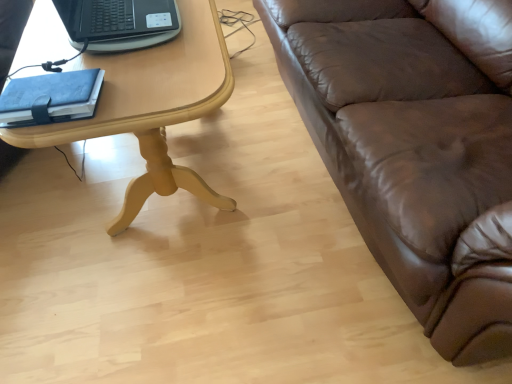
At what (x,y) coordinates should I click in order to perform the action: click on brown leather couch at right. Please return your answer as a coordinate pair (x, y). Image resolution: width=512 pixels, height=384 pixels. Looking at the image, I should click on (416, 147).

This screenshot has height=384, width=512. I want to click on blue leather notebook at left, so click(50, 98).

Is the surface of black plastic laptop at upper left in direct contact with brown leather couch at right?

There is a gap between black plastic laptop at upper left and brown leather couch at right.

Does point (176, 9) appear closer or farther from the camera than point (436, 27)?

Point (176, 9).

From a real-world perspective, who is located lower, black plastic laptop at upper left or brown leather couch at right?

In real-world perspective, brown leather couch at right is lower.

Identify the location of studio couch above the black plastic laptop at upper left (from the image's perspective). The image size is (512, 384). (416, 147).

Is brown leather couch at right facing away from blue leather notebook at left?

That's not correct — brown leather couch at right is not looking away from blue leather notebook at left.

From a real-world perspective, is brown leather couch at right physically below blue leather notebook at left?

Yes, from a real-world perspective, brown leather couch at right is beneath blue leather notebook at left.

From the image's perspective, would you say brown leather couch at right is shown under blue leather notebook at left?

Incorrect, from the image's perspective, brown leather couch at right is higher than blue leather notebook at left.

Considering the sizes of objects brown leather couch at right and blue leather notebook at left in the image provided, who is smaller, brown leather couch at right or blue leather notebook at left?

blue leather notebook at left.

Is black plastic laptop at upper left surrounding blue leather notebook at left?

That's incorrect, blue leather notebook at left is not inside black plastic laptop at upper left.

Considering the relative sizes of black plastic laptop at upper left and blue leather notebook at left in the image provided, is black plastic laptop at upper left thinner than blue leather notebook at left?

In fact, black plastic laptop at upper left might be wider than blue leather notebook at left.

In the scene shown: From the image's perspective, is black plastic laptop at upper left below blue leather notebook at left?

No.

In the scene shown: Is black plastic laptop at upper left oriented towards blue leather notebook at left?

No, black plastic laptop at upper left is not oriented towards blue leather notebook at left.

Is blue leather notebook at left positioned in front of black plastic laptop at upper left?

Yes, it is in front of black plastic laptop at upper left.

Considering the positions of points (95, 95) and (66, 20), is point (95, 95) farther from camera compared to point (66, 20)?

No, (95, 95) is in front of (66, 20).

Looking at this image, from the image's perspective, which one is positioned lower, blue leather notebook at left or black plastic laptop at upper left?

blue leather notebook at left appears lower in the image.

Between blue leather notebook at left and black plastic laptop at upper left, which one has more height?

black plastic laptop at upper left.

From a real-world perspective, is light wood/yellowishmaterial/texture table at left positioned over black plastic laptop at upper left based on gravity?

Incorrect, from a real-world perspective, light wood/yellowishmaterial/texture table at left is lower than black plastic laptop at upper left.

Based on their sizes in the image, would you say light wood/yellowishmaterial/texture table at left is bigger or smaller than black plastic laptop at upper left?

Clearly, light wood/yellowishmaterial/texture table at left is larger in size than black plastic laptop at upper left.

How many degrees apart are the facing directions of light wood/yellowishmaterial/texture table at left and black plastic laptop at upper left?

The angle between the facing direction of light wood/yellowishmaterial/texture table at left and the facing direction of black plastic laptop at upper left is 0.693 degrees.

Where is `table located in front of the black plastic laptop at upper left`? The image size is (512, 384). table located in front of the black plastic laptop at upper left is located at coordinates (153, 106).

From a real-world perspective, between black plastic laptop at upper left and light wood/yellowishmaterial/texture table at left, who is vertically higher?

black plastic laptop at upper left.

From the image's perspective, which is below, black plastic laptop at upper left or light wood/yellowishmaterial/texture table at left?

From the image's view, light wood/yellowishmaterial/texture table at left is below.

Does black plastic laptop at upper left come in front of light wood/yellowishmaterial/texture table at left?

No, the depth of black plastic laptop at upper left is greater than that of light wood/yellowishmaterial/texture table at left.

Can you tell me how much black plastic laptop at upper left and light wood/yellowishmaterial/texture table at left differ in facing direction?

The angle between the facing direction of black plastic laptop at upper left and the facing direction of light wood/yellowishmaterial/texture table at left is 0.693 degrees.

Which point is more forward, (128,63) or (50,115)?

The point (50,115) is in front.

Is light wood/yellowishmaterial/texture table at left aimed at blue leather notebook at left?

No, light wood/yellowishmaterial/texture table at left is not aimed at blue leather notebook at left.

Is light wood/yellowishmaterial/texture table at left thinner than blue leather notebook at left?

No, light wood/yellowishmaterial/texture table at left is not thinner than blue leather notebook at left.

From a real-world perspective, is light wood/yellowishmaterial/texture table at left positioned above or below blue leather notebook at left?

Clearly, from a real-world perspective, light wood/yellowishmaterial/texture table at left is below blue leather notebook at left.

At what (x,y) coordinates should I click in order to perform the action: click on laptop below the brown leather couch at right (from the image's perspective). Please return your answer as a coordinate pair (x, y). This screenshot has height=384, width=512. Looking at the image, I should click on (119, 23).

Where is `studio couch below the blue leather notebook at left (from a real-world perspective)`? The height and width of the screenshot is (384, 512). studio couch below the blue leather notebook at left (from a real-world perspective) is located at coordinates (416, 147).

From the image, which object appears to be farther from brown leather couch at right, black plastic laptop at upper left or blue leather notebook at left?

blue leather notebook at left lies further to brown leather couch at right than the other object.

When comparing their distances from light wood/yellowishmaterial/texture table at left, does blue leather notebook at left or brown leather couch at right seem further?

Based on the image, brown leather couch at right appears to be further to light wood/yellowishmaterial/texture table at left.

Based on the photo, which object lies nearer to the anchor point brown leather couch at right, black plastic laptop at upper left or light wood/yellowishmaterial/texture table at left?

The object closer to brown leather couch at right is light wood/yellowishmaterial/texture table at left.

Looking at the image, which one is located closer to blue leather notebook at left, black plastic laptop at upper left or brown leather couch at right?

Among the two, black plastic laptop at upper left is located nearer to blue leather notebook at left.

When comparing their distances from black plastic laptop at upper left, does blue leather notebook at left or brown leather couch at right seem further?

Among the two, brown leather couch at right is located further to black plastic laptop at upper left.

Based on their spatial positions, is brown leather couch at right or light wood/yellowishmaterial/texture table at left closer to black plastic laptop at upper left?

light wood/yellowishmaterial/texture table at left is closer to black plastic laptop at upper left.

When comparing their distances from black plastic laptop at upper left, does brown leather couch at right or blue leather notebook at left seem further?

Based on the image, brown leather couch at right appears to be further to black plastic laptop at upper left.

Which object lies nearer to the anchor point light wood/yellowishmaterial/texture table at left, black plastic laptop at upper left or blue leather notebook at left?

black plastic laptop at upper left.

Locate an element on the screen. laptop between blue leather notebook at left and brown leather couch at right from left to right is located at coordinates (119, 23).

This screenshot has height=384, width=512. I want to click on table that lies between black plastic laptop at upper left and blue leather notebook at left from top to bottom, so click(153, 106).

Locate an element on the screen. table between blue leather notebook at left and brown leather couch at right is located at coordinates (153, 106).

What are the coordinates of `laptop situated between light wood/yellowishmaterial/texture table at left and brown leather couch at right from left to right` in the screenshot? It's located at (119, 23).